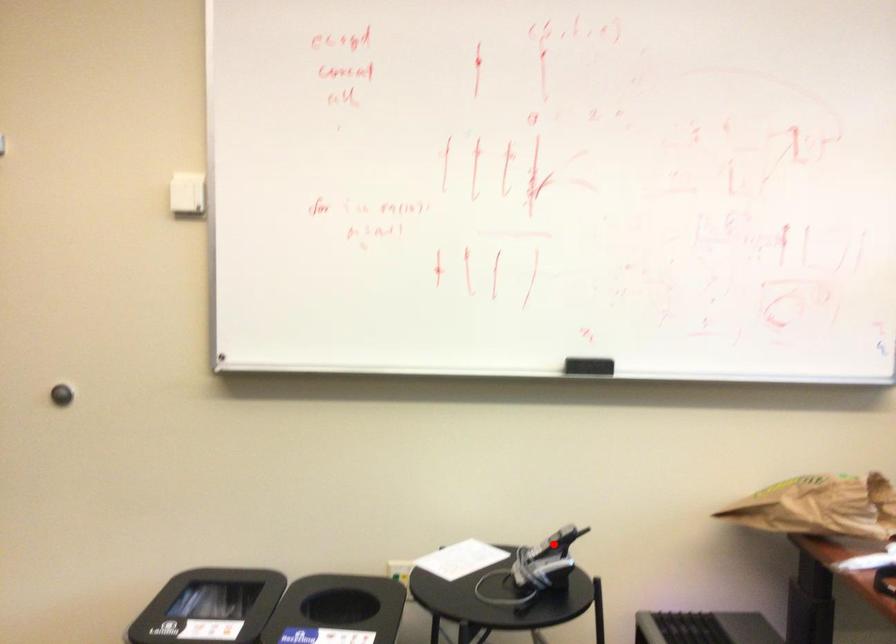
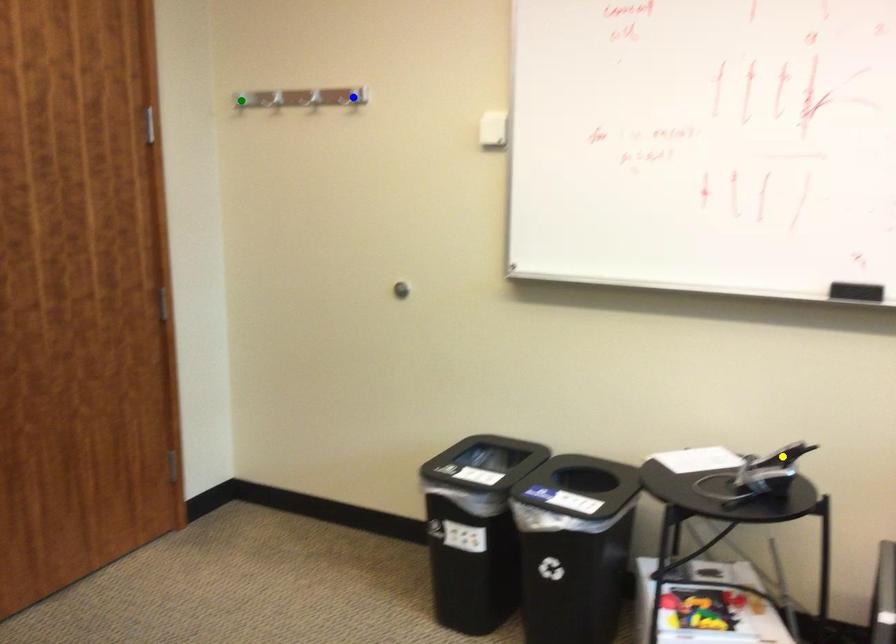
Question: I am providing you with two images of the same scene from different viewpoints. A red point is marked on the first image. You are given multiple points on the second image. Which point in image 2 represents the same 3d spot as the red point in image 1?

Choices:
 (A) green point
 (B) blue point
 (C) yellow point

Answer: (C)